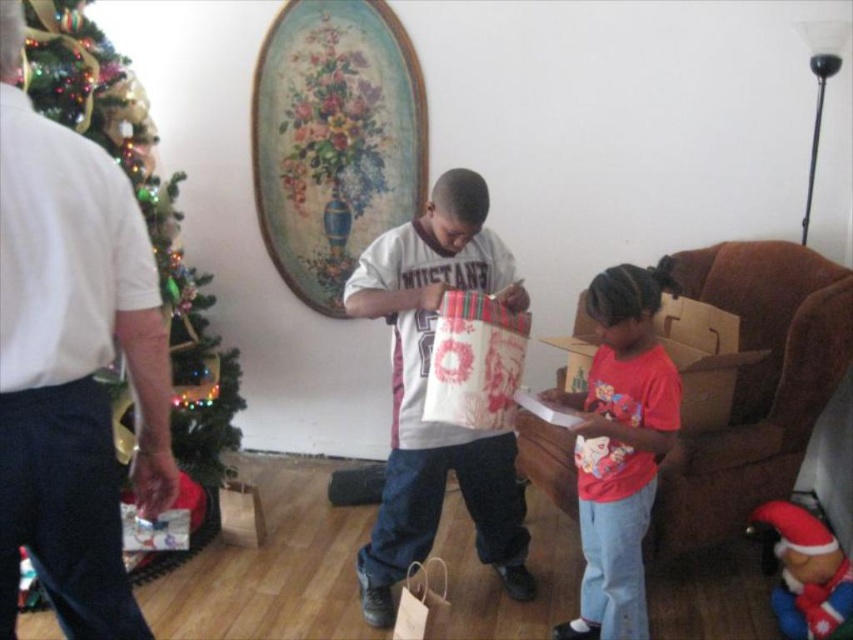
Question: Is white cotton t-shirt at center smaller than red cotton shirt at center?

Choices:
 (A) no
 (B) yes

Answer: (A)

Question: Which object is closer to the camera taking this photo?

Choices:
 (A) red cardboard box at lower right
 (B) velvety red santa at lower right
 (C) decorated green christmas tree at left
 (D) red cotton shirt at center

Answer: (D)

Question: Which of the following is the farthest from the observer?

Choices:
 (A) red cotton shirt at center
 (B) decorated green christmas tree at left
 (C) velvety red santa at lower right
 (D) white cotton t-shirt at center

Answer: (B)

Question: Can you confirm if white cotton t-shirt at center is wider than red cardboard box at lower right?

Choices:
 (A) yes
 (B) no

Answer: (B)

Question: Which object is positioned farthest from the decorated green christmas tree at left?

Choices:
 (A) red cotton shirt at center
 (B) velvety red santa at lower right
 (C) white cotton t-shirt at center
 (D) red cardboard box at lower right

Answer: (B)

Question: Can you confirm if white cotton t-shirt at center is thinner than decorated green christmas tree at left?

Choices:
 (A) no
 (B) yes

Answer: (A)